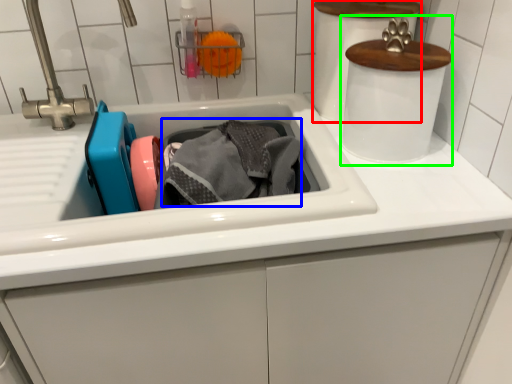
Question: Considering the real-world distances, which object is farthest from appliance (highlighted by a red box)? material (highlighted by a blue box) or appliance (highlighted by a green box)?

Choices:
 (A) material
 (B) appliance

Answer: (A)